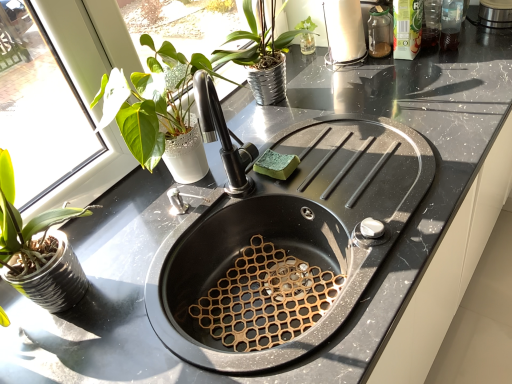
In order to click on free space to the left of white glossy paper towel holder at upper right in this screenshot , I will do pos(309,76).